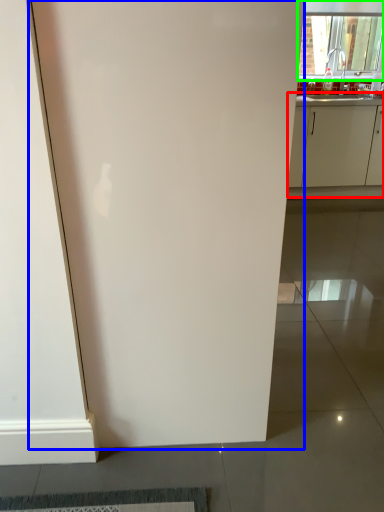
Question: Which object is the farthest from cabinetry (highlighted by a red box)? Choose among these: door (highlighted by a blue box) or window (highlighted by a green box).

Choices:
 (A) door
 (B) window

Answer: (A)